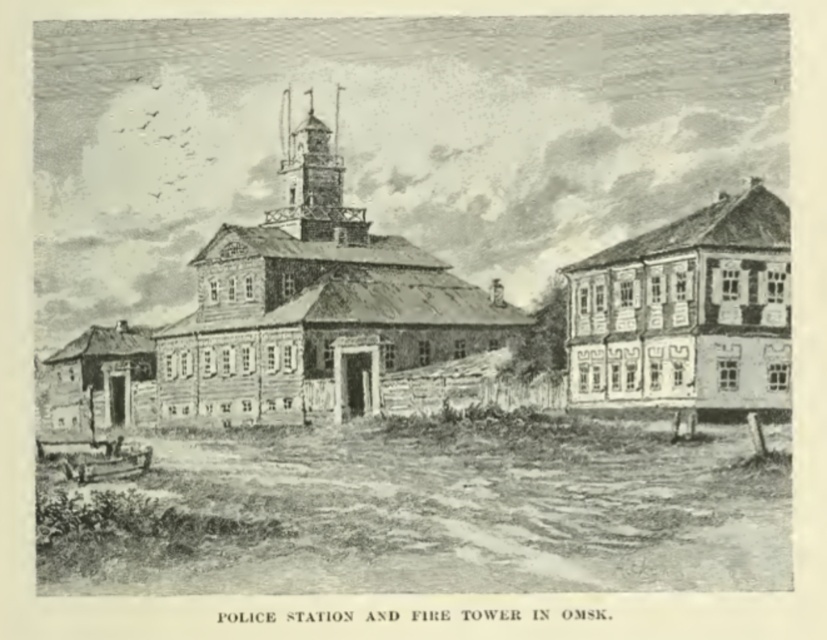
Question: Which object is farther from the camera taking this photo?

Choices:
 (A) wooden tower at center
 (B) wooden house at right

Answer: (A)

Question: Does wooden tower at center have a greater width compared to wooden house at right?

Choices:
 (A) yes
 (B) no

Answer: (A)

Question: Can you confirm if wooden tower at center is wider than wooden house at right?

Choices:
 (A) no
 (B) yes

Answer: (B)

Question: Is wooden tower at center positioned at the back of wooden house at right?

Choices:
 (A) no
 (B) yes

Answer: (B)